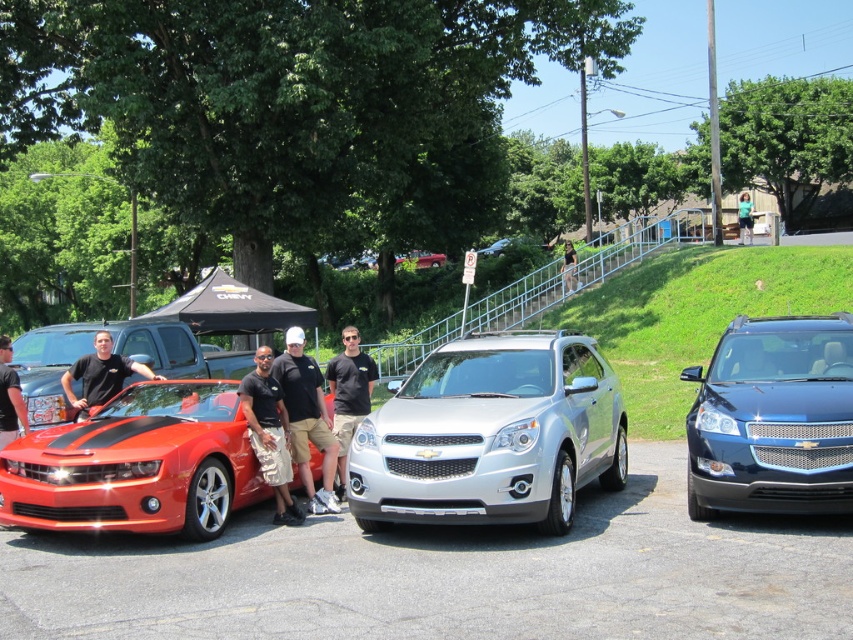
Question: Among these objects, which one is nearest to the camera?

Choices:
 (A) glossy blue suv at center
 (B) matte black t-shirt at center
 (C) shiny red car at left
 (D) shiny orange car at left

Answer: (A)

Question: Which point appears farthest from the camera in this image?

Choices:
 (A) (84, 408)
 (B) (62, 456)
 (C) (32, 355)

Answer: (C)

Question: Which of the following is the closest to the observer?

Choices:
 (A) (573, 282)
 (B) (340, 467)
 (C) (148, 374)

Answer: (B)

Question: Can you confirm if matte black t-shirt at center is bigger than metallic red car at center?

Choices:
 (A) yes
 (B) no

Answer: (A)

Question: Considering the relative positions of silver metallic suv at center and black cotton shirt at center in the image provided, where is silver metallic suv at center located with respect to black cotton shirt at center?

Choices:
 (A) above
 (B) below

Answer: (B)

Question: In this image, where is silver metallic suv at center located relative to shiny orange car at left?

Choices:
 (A) right
 (B) left

Answer: (A)